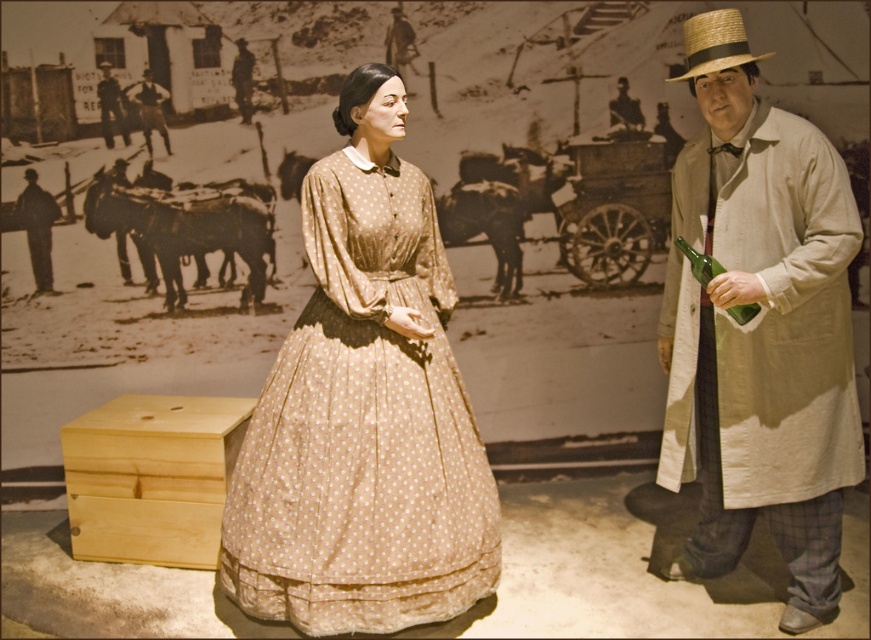
Which is in front, point (694, 26) or point (147, 74)?

Point (694, 26) is in front.

Does point (747, 52) come farther from viewer compared to point (163, 141)?

No, it is in front of (163, 141).

Between point (685, 38) and point (165, 90), which one is positioned in front?

Point (685, 38) is in front.

Find the location of a particular element. The image size is (871, 640). strawmaterial/texturehat at upper right is located at coordinates (714, 44).

Looking at this image, is matte beige dress at center to the left of strawmaterial/texturehat at upper right from the viewer's perspective?

Yes, matte beige dress at center is to the left of strawmaterial/texturehat at upper right.

Can you confirm if matte beige dress at center is smaller than strawmaterial/texturehat at upper right?

Incorrect, matte beige dress at center is not smaller in size than strawmaterial/texturehat at upper right.

Between point (275, 532) and point (676, 81), which one is positioned behind?

The point (676, 81) is more distant.

Find the location of `matte beige dress at center`. matte beige dress at center is located at coordinates (363, 410).

Measure the distance between point [701,72] and camera.

8.72 feet

Who is positioned more to the left, strawmaterial/texturehat at upper right or dark brown leather jacket at upper left?

dark brown leather jacket at upper left

Which is in front, point (691, 76) or point (105, 125)?

Point (691, 76) is in front.

You are a GUI agent. You are given a task and a screenshot of the screen. Output one action in this format:
    pyautogui.click(x=<x>, y=<y>)
    Task: Click on the strawmaterial/texturehat at upper right
    This screenshot has height=640, width=871.
    Given the screenshot: What is the action you would take?
    pyautogui.click(x=714, y=44)